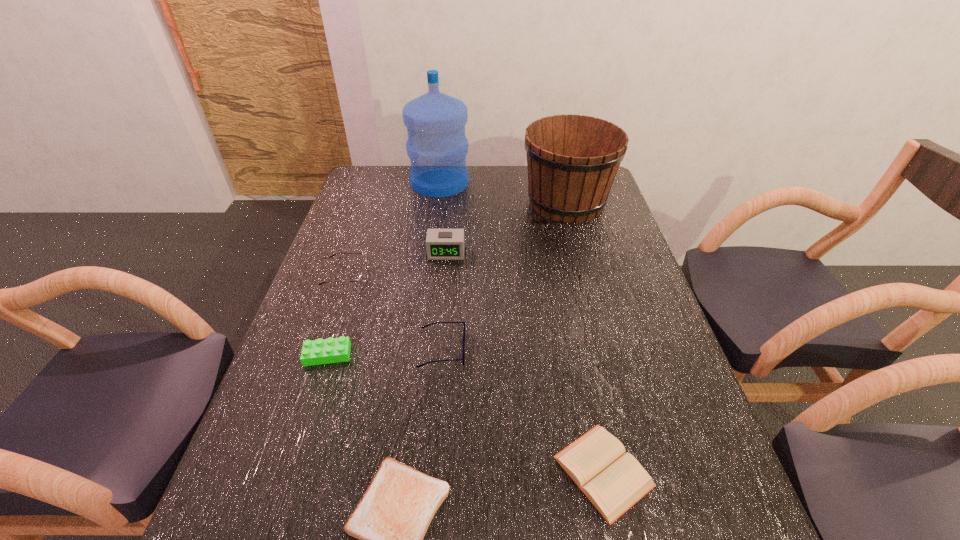
You are a GUI agent. You are given a task and a screenshot of the screen. Output one action in this format:
    pyautogui.click(x=<x>, y=<y>)
    Task: Click on the free space between the farther spectacles and the diary
    
    Given the screenshot: What is the action you would take?
    pyautogui.click(x=474, y=373)

Image resolution: width=960 pixels, height=540 pixels. What are the coordinates of `vacant region between the diary and the water jug` in the screenshot? It's located at (521, 327).

You are a GUI agent. You are given a task and a screenshot of the screen. Output one action in this format:
    pyautogui.click(x=<x>, y=<y>)
    Task: Click on the vacant space that's between the seventh tallest object and the nearer spectacles
    The image size is (960, 540).
    Given the screenshot: What is the action you would take?
    pyautogui.click(x=522, y=410)

This screenshot has height=540, width=960. Find the location of `vacant area that lies between the farther spectacles and the third tallest object`. vacant area that lies between the farther spectacles and the third tallest object is located at coordinates click(396, 264).

At what (x,y) coordinates should I click in order to perform the action: click on free spot between the Lego and the diary. Please return your answer as a coordinate pair (x, y). Image resolution: width=960 pixels, height=540 pixels. Looking at the image, I should click on (466, 413).

The width and height of the screenshot is (960, 540). I want to click on object identified as the second closest to the second tallest object, so click(x=441, y=244).

The width and height of the screenshot is (960, 540). I want to click on object that is the fourth closest to the Lego, so click(441, 244).

You are a GUI agent. You are given a task and a screenshot of the screen. Output one action in this format:
    pyautogui.click(x=<x>, y=<y>)
    Task: Click on the vacant space that satisfies the following two spatial constraints: 1. on the back side of the Lego; 2. on the front-facing side of the fourth farthest object
    The height and width of the screenshot is (540, 960).
    Given the screenshot: What is the action you would take?
    pyautogui.click(x=353, y=276)

The width and height of the screenshot is (960, 540). What are the coordinates of `vacant space that satisfies the following two spatial constraints: 1. on the front-facing side of the left spectacles; 2. on the left side of the diary` in the screenshot? It's located at (280, 471).